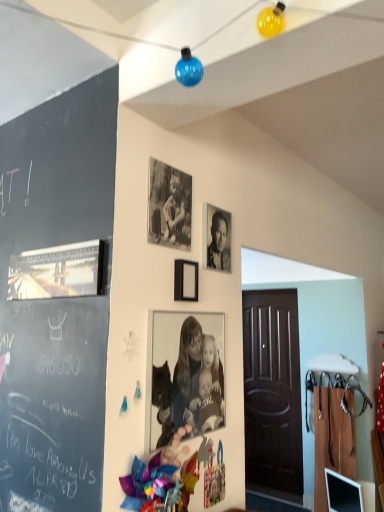
Describe the element at coordinates (218, 243) in the screenshot. I see `black and white photograph at upper center, positioned as the first person in top-to-bottom order` at that location.

Locate an element on the screen. Image resolution: width=384 pixels, height=512 pixels. metallic silver picture frame at left, the 3th picture frame from the right is located at coordinates (57, 271).

Is black and white photograph of people at center, which is the 1th person in bottom-to-top order, not inside black and white photograph at upper center, positioned as the first person in top-to-bottom order?

Indeed, black and white photograph of people at center, which is the 1th person in bottom-to-top order, is completely outside black and white photograph at upper center, positioned as the first person in top-to-bottom order.

Does black and white photograph of people at center, which ranks as the 2th person in top-to-bottom order, have a greater width compared to black and white photograph at upper center, positioned as the first person in top-to-bottom order?

In fact, black and white photograph of people at center, which ranks as the 2th person in top-to-bottom order, might be narrower than black and white photograph at upper center, positioned as the first person in top-to-bottom order.

From a real-world perspective, which picture frame is the 1st one above the matte black picture frame at upper center, arranged as the third picture frame when viewed from the left? Please provide its 2D coordinates.

[(57, 271)]

Based on the photo, is matte black picture frame at upper center, which is the first picture frame from right to left, at the right side of metallic silver picture frame at left, marked as the 1th picture frame in a left-to-right arrangement?

Correct, you'll find matte black picture frame at upper center, which is the first picture frame from right to left, to the right of metallic silver picture frame at left, marked as the 1th picture frame in a left-to-right arrangement.

From the picture: How distant is matte black picture frame at upper center, arranged as the third picture frame when viewed from the left, from metallic silver picture frame at left, the 3th picture frame from the right?

matte black picture frame at upper center, arranged as the third picture frame when viewed from the left, is 18.34 inches from metallic silver picture frame at left, the 3th picture frame from the right.

In the scene shown: Is matte black picture frame at upper center, which is the first picture frame from right to left, in contact with metallic silver picture frame at left, the 3th picture frame from the right?

matte black picture frame at upper center, which is the first picture frame from right to left, and metallic silver picture frame at left, the 3th picture frame from the right, are clearly separated.

Is black and white photograph of people at center, which is the 1th person in bottom-to-top order, completely or partially outside of matte black picture frame at upper center, arranged as the third picture frame when viewed from the left?

Indeed, black and white photograph of people at center, which is the 1th person in bottom-to-top order, is completely outside matte black picture frame at upper center, arranged as the third picture frame when viewed from the left.

Between black and white photograph of people at center, which is the 1th person in bottom-to-top order, and matte black picture frame at upper center, arranged as the third picture frame when viewed from the left, which one has smaller width?

black and white photograph of people at center, which is the 1th person in bottom-to-top order, is thinner.

I want to click on the 1st picture frame above the black and white photograph of people at center, which is the 1th person in bottom-to-top order (from the image's perspective), so click(x=186, y=280).

In the image, is black and white photograph of people at center, which ranks as the 2th person in top-to-bottom order, on the left side or the right side of matte black picture frame at upper center, which is the first picture frame from right to left?

Clearly, black and white photograph of people at center, which ranks as the 2th person in top-to-bottom order, is on the right of matte black picture frame at upper center, which is the first picture frame from right to left, in the image.

The width and height of the screenshot is (384, 512). Find the location of `picture frame that is the 2nd one when counting rightward from the metallic silver picture frame at left, marked as the 1th picture frame in a left-to-right arrangement`. picture frame that is the 2nd one when counting rightward from the metallic silver picture frame at left, marked as the 1th picture frame in a left-to-right arrangement is located at coordinates (186, 280).

From the image's perspective, is metallic silver picture frame at left, the 3th picture frame from the right, located above or below matte black picture frame at upper center, which is the first picture frame from right to left?

Clearly, from the image's perspective, metallic silver picture frame at left, the 3th picture frame from the right, is above matte black picture frame at upper center, which is the first picture frame from right to left.

Does metallic silver picture frame at left, marked as the 1th picture frame in a left-to-right arrangement, lie in front of matte black picture frame at upper center, arranged as the third picture frame when viewed from the left?

Yes, the depth of metallic silver picture frame at left, marked as the 1th picture frame in a left-to-right arrangement, is less than that of matte black picture frame at upper center, arranged as the third picture frame when viewed from the left.

Could you tell me if black and white photograph at upper center, the second person ordered from the bottom, is facing metallic silver picture frame at left, the 3th picture frame from the right?

No, black and white photograph at upper center, the second person ordered from the bottom, is not oriented towards metallic silver picture frame at left, the 3th picture frame from the right.

Is black and white photograph at upper center, the second person ordered from the bottom, located outside metallic silver picture frame at left, the 3th picture frame from the right?

Yes, black and white photograph at upper center, the second person ordered from the bottom, is not within metallic silver picture frame at left, the 3th picture frame from the right.

Does black and white photograph at upper center, positioned as the first person in top-to-bottom order, have a lesser height compared to metallic silver picture frame at left, the 3th picture frame from the right?

No, black and white photograph at upper center, positioned as the first person in top-to-bottom order, is not shorter than metallic silver picture frame at left, the 3th picture frame from the right.

Can you confirm if matte black picture frame at upper center, which is the first picture frame from right to left, is taller than black and white photograph of people at center, which ranks as the 2th person in top-to-bottom order?

No.

Can you confirm if matte black picture frame at upper center, which is the first picture frame from right to left, is wider than black and white photograph of people at center, which ranks as the 2th person in top-to-bottom order?

Yes.

How much distance is there between matte black picture frame at upper center, which is the first picture frame from right to left, and black and white photograph of people at center, which ranks as the 2th person in top-to-bottom order?

12.49 inches.

Is matte black picture frame at upper center, arranged as the third picture frame when viewed from the left, aimed at black and white photograph of people at center, which is the 1th person in bottom-to-top order?

No, matte black picture frame at upper center, arranged as the third picture frame when viewed from the left, is not turned towards black and white photograph of people at center, which is the 1th person in bottom-to-top order.

Considering the positions of objects metallic silver picture frame at left, marked as the 1th picture frame in a left-to-right arrangement, and black and white photograph at upper center, positioned as the first person in top-to-bottom order, in the image provided, who is more to the left, metallic silver picture frame at left, marked as the 1th picture frame in a left-to-right arrangement, or black and white photograph at upper center, positioned as the first person in top-to-bottom order,?

metallic silver picture frame at left, marked as the 1th picture frame in a left-to-right arrangement, is more to the left.

Is metallic silver picture frame at left, the 3th picture frame from the right, turned away from black and white photograph at upper center, positioned as the first person in top-to-bottom order?

Yes, metallic silver picture frame at left, the 3th picture frame from the right,'s orientation is away from black and white photograph at upper center, positioned as the first person in top-to-bottom order.

Which is in front, point (94, 244) or point (215, 229)?

The point (94, 244) is closer to the camera.

Between metallic silver picture frame at left, the 3th picture frame from the right, and black and white photograph at upper center, the second person ordered from the bottom, which one is positioned in front?

metallic silver picture frame at left, the 3th picture frame from the right, is in front.

This screenshot has width=384, height=512. Identify the location of person in front of the black and white photograph at upper center, the second person ordered from the bottom. pyautogui.click(x=197, y=381).

Starting from the metallic silver picture frame at left, marked as the 1th picture frame in a left-to-right arrangement, which picture frame is the 2nd one to the right? Please provide its 2D coordinates.

[(186, 280)]

Which object lies further to the anchor point metallic silver picture frame at left, the 3th picture frame from the right, black matte photo frame at center, which is counted as the 2th picture frame, starting from the left, or black and white photograph of people at center, which ranks as the 2th person in top-to-bottom order?

black and white photograph of people at center, which ranks as the 2th person in top-to-bottom order, lies further to metallic silver picture frame at left, the 3th picture frame from the right, than the other object.

From the image, which object appears to be nearer to black matte photo frame at center, the second picture frame positioned from the right, black and white photograph of people at center, which ranks as the 2th person in top-to-bottom order, or black and white photograph at upper center, the second person ordered from the bottom?

black and white photograph at upper center, the second person ordered from the bottom.

Considering their positions, is metallic silver picture frame at left, the 3th picture frame from the right, positioned closer to black and white photograph of people at center, which is the 1th person in bottom-to-top order, than black and white photograph at upper center, positioned as the first person in top-to-bottom order?

black and white photograph at upper center, positioned as the first person in top-to-bottom order, is closer to black and white photograph of people at center, which is the 1th person in bottom-to-top order.

Looking at the image, which one is located further to matte black picture frame at upper center, which is the first picture frame from right to left, black and white photograph of people at center, which ranks as the 2th person in top-to-bottom order, or black and white photograph at upper center, positioned as the first person in top-to-bottom order?

black and white photograph of people at center, which ranks as the 2th person in top-to-bottom order, is positioned further to the anchor matte black picture frame at upper center, which is the first picture frame from right to left.

From the image, which object appears to be nearer to black and white photograph of people at center, which is the 1th person in bottom-to-top order, black matte photo frame at center, which is counted as the 2th picture frame, starting from the left, or black and white photograph at upper center, positioned as the first person in top-to-bottom order?

black and white photograph at upper center, positioned as the first person in top-to-bottom order, is closer to black and white photograph of people at center, which is the 1th person in bottom-to-top order.

Based on the photo, from the image, which object appears to be farther from black matte photo frame at center, the second picture frame positioned from the right, metallic silver picture frame at left, marked as the 1th picture frame in a left-to-right arrangement, or matte black picture frame at upper center, arranged as the third picture frame when viewed from the left?

metallic silver picture frame at left, marked as the 1th picture frame in a left-to-right arrangement.

Based on their spatial positions, is black matte photo frame at center, the second picture frame positioned from the right, or metallic silver picture frame at left, the 3th picture frame from the right, further from black and white photograph of people at center, which ranks as the 2th person in top-to-bottom order?

Based on the image, metallic silver picture frame at left, the 3th picture frame from the right, appears to be further to black and white photograph of people at center, which ranks as the 2th person in top-to-bottom order.

Based on the photo, when comparing their distances from black matte photo frame at center, the second picture frame positioned from the right, does matte black picture frame at upper center, arranged as the third picture frame when viewed from the left, or black and white photograph at upper center, positioned as the first person in top-to-bottom order, seem closer?

matte black picture frame at upper center, arranged as the third picture frame when viewed from the left, is closer to black matte photo frame at center, the second picture frame positioned from the right.

Find the location of a particular element. The width and height of the screenshot is (384, 512). person between black matte photo frame at center, which is counted as the 2th picture frame, starting from the left, and matte black picture frame at upper center, which is the first picture frame from right to left, from top to bottom is located at coordinates (218, 243).

Find the location of a particular element. Image resolution: width=384 pixels, height=512 pixels. picture frame between metallic silver picture frame at left, the 3th picture frame from the right, and matte black picture frame at upper center, arranged as the third picture frame when viewed from the left is located at coordinates (169, 206).

Locate an element on the screen. This screenshot has height=512, width=384. person located between metallic silver picture frame at left, the 3th picture frame from the right, and black and white photograph at upper center, positioned as the first person in top-to-bottom order, in the left-right direction is located at coordinates click(197, 381).

I want to click on person between black matte photo frame at center, the second picture frame positioned from the right, and black and white photograph of people at center, which ranks as the 2th person in top-to-bottom order, from top to bottom, so click(218, 243).